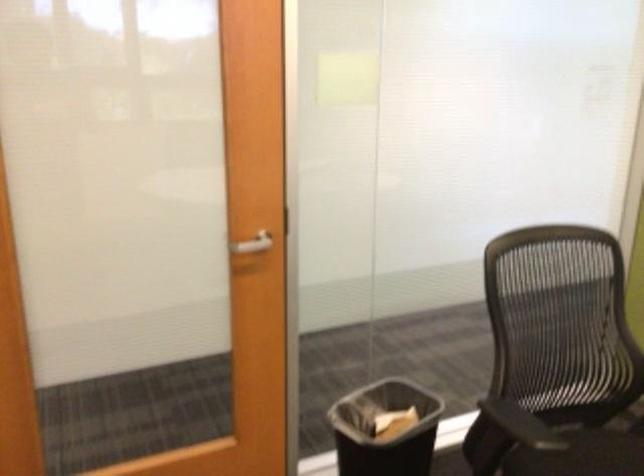
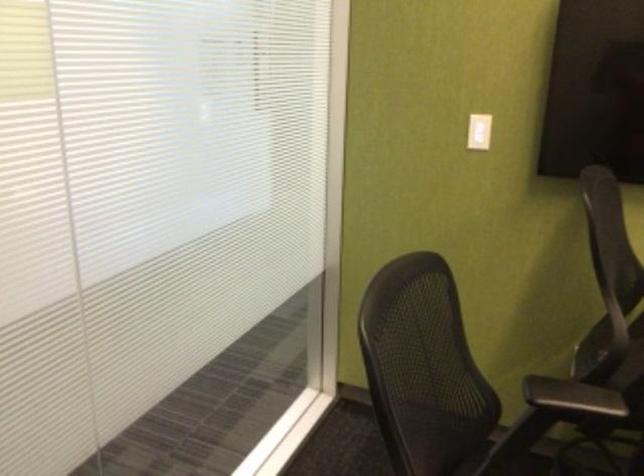
Question: The camera is either moving clockwise (left) or counter-clockwise (right) around the object. The first image is from the beginning of the video and the second image is from the end. Is the camera moving left or right when shooting the video?

Choices:
 (A) Left
 (B) Right

Answer: (A)